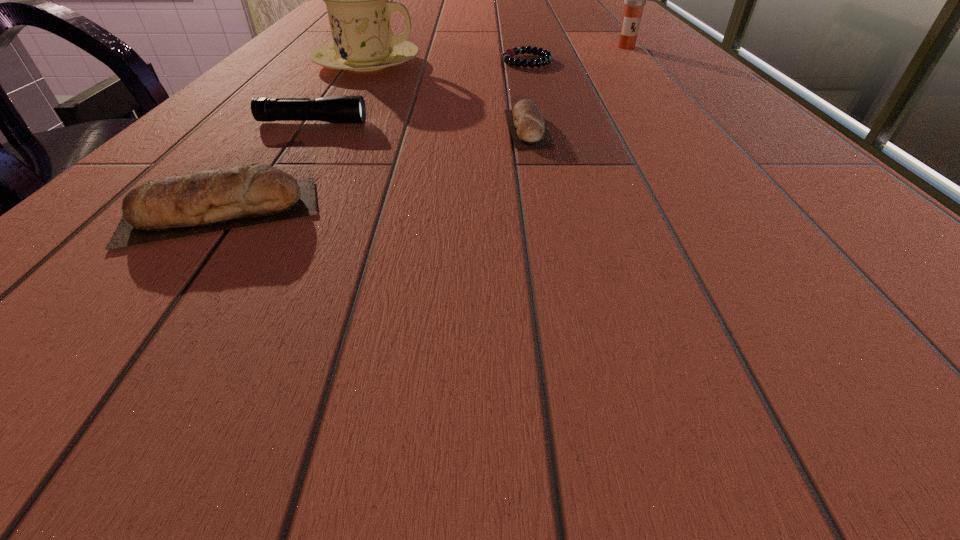
You are a GUI agent. You are given a task and a screenshot of the screen. Output one action in this format:
    pyautogui.click(x=<x>, y=<y>)
    Task: Click on the taller pita bread
    This screenshot has height=540, width=960.
    Given the screenshot: What is the action you would take?
    pyautogui.click(x=207, y=201)

This screenshot has width=960, height=540. Find the location of `the nearer pita bread`. the nearer pita bread is located at coordinates 207,201.

This screenshot has width=960, height=540. Identify the location of the shorter pita bread. 528,130.

Identify the location of the farther pita bread. (528, 130).

Where is `flashlight`? flashlight is located at coordinates point(347,109).

The image size is (960, 540). Identify the location of chinaware. (357, 0).

Where is `medicine`? This screenshot has height=540, width=960. medicine is located at coordinates coord(634,0).

The image size is (960, 540). In order to click on bracelet in this screenshot , I will do (x=508, y=57).

I want to click on blank space located 0.230m on the back of the taller pita bread, so click(300, 111).

Where is `vacant space located on the left of the right pita bread`? The width and height of the screenshot is (960, 540). vacant space located on the left of the right pita bread is located at coordinates (283, 129).